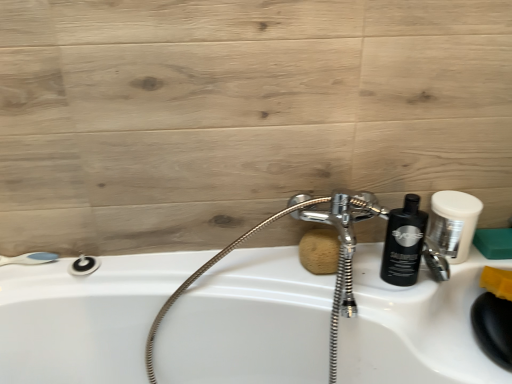
Describe the element at coordinates (319, 251) in the screenshot. The image size is (512, 384). I see `brown sponge at center, arranged as the second soap when viewed from the right` at that location.

Describe the element at coordinates (249, 323) in the screenshot. The image size is (512, 384). I see `white glossy sink at center` at that location.

Image resolution: width=512 pixels, height=384 pixels. I want to click on white glossy sink at center, so click(249, 323).

The width and height of the screenshot is (512, 384). What do you see at coordinates (494, 243) in the screenshot?
I see `green sponge at right, which ranks as the second soap in left-to-right order` at bounding box center [494, 243].

Where is `brown sponge at center, which appears as the 1th soap when viewed from the left`? The width and height of the screenshot is (512, 384). brown sponge at center, which appears as the 1th soap when viewed from the left is located at coordinates (319, 251).

Is point (403, 244) positioned in front of point (386, 349)?

No, (403, 244) is behind (386, 349).

From a real-world perspective, who is located higher, white matte shaving cream at upper right or white glossy sink at center?

white matte shaving cream at upper right.

Can you tell me how much white matte shaving cream at upper right and white glossy sink at center differ in facing direction?

0.0606 degrees.

From the image's perspective, which one is positioned lower, white matte shaving cream at upper right or white glossy sink at center?

white glossy sink at center.

Can you tell me how much brown sponge at center, which appears as the 1th soap when viewed from the left, and black glossy bottle at right differ in facing direction?

0.000436 degrees separate the facing orientations of brown sponge at center, which appears as the 1th soap when viewed from the left, and black glossy bottle at right.

Can you confirm if brown sponge at center, arranged as the second soap when viewed from the right, is bigger than black glossy bottle at right?

Incorrect, brown sponge at center, arranged as the second soap when viewed from the right, is not larger than black glossy bottle at right.

Is point (305, 244) less distant than point (459, 206)?

No, it is not.

Considering the relative sizes of brown sponge at center, arranged as the second soap when viewed from the right, and black glossy bottle at right in the image provided, is brown sponge at center, arranged as the second soap when viewed from the right, wider than black glossy bottle at right?

In fact, brown sponge at center, arranged as the second soap when viewed from the right, might be narrower than black glossy bottle at right.

From the image's perspective, does white plastic shower at left, the 2th shower viewed from the right, appear higher than green sponge at right, which ranks as the second soap in left-to-right order?

No, from the image's perspective, white plastic shower at left, the 2th shower viewed from the right, is not over green sponge at right, which ranks as the second soap in left-to-right order.

Considering the relative sizes of white plastic shower at left, the 2th shower viewed from the right, and green sponge at right, marked as the 1th soap in a right-to-left arrangement, in the image provided, is white plastic shower at left, the 2th shower viewed from the right, smaller than green sponge at right, marked as the 1th soap in a right-to-left arrangement,?

Actually, white plastic shower at left, the 2th shower viewed from the right, might be larger than green sponge at right, marked as the 1th soap in a right-to-left arrangement.

Looking at this image, which is nearer, (39, 263) or (501, 234)?

The point (39, 263) is closer to the camera.

In the scene shown: Can you confirm if white plastic shower at left, placed as the 1th shower when sorted from left to right, is positioned to the left of green sponge at right, which ranks as the second soap in left-to-right order?

Correct, you'll find white plastic shower at left, placed as the 1th shower when sorted from left to right, to the left of green sponge at right, which ranks as the second soap in left-to-right order.

From a real-world perspective, which object stands above the other?

From a 3D spatial view, white matte shaving cream at upper right is above.

Which object is wider, white matte shaving cream at upper right or matte black shower at lower left, the second shower when ordered from left to right?

With larger width is white matte shaving cream at upper right.

Consider the image. Between white matte shaving cream at upper right and matte black shower at lower left, the second shower when ordered from left to right, which one has less height?

matte black shower at lower left, the second shower when ordered from left to right.

From a real-world perspective, is matte black shower at lower left, the second shower when ordered from left to right, positioned over white glossy sink at center based on gravity?

Yes.

From a real-world perspective, count 1st showers upward from the white glossy sink at center and point to it. Please provide its 2D coordinates.

[(84, 265)]

Are matte black shower at lower left, the second shower when ordered from left to right, and white glossy sink at center making contact?

No, matte black shower at lower left, the second shower when ordered from left to right, is not touching white glossy sink at center.

Consider the image. Can we say matte black shower at lower left, the second shower when ordered from left to right, lies outside white glossy sink at center?

matte black shower at lower left, the second shower when ordered from left to right, is positioned outside white glossy sink at center.

From the image's perspective, which soap is the 2nd one below the white matte shaving cream at upper right? Please provide its 2D coordinates.

[(319, 251)]

Does white matte shaving cream at upper right come in front of brown sponge at center, arranged as the second soap when viewed from the right?

Yes, white matte shaving cream at upper right is in front of brown sponge at center, arranged as the second soap when viewed from the right.

Is white matte shaving cream at upper right oriented away from brown sponge at center, which appears as the 1th soap when viewed from the left?

That's not correct — white matte shaving cream at upper right is not looking away from brown sponge at center, which appears as the 1th soap when viewed from the left.

Considering the positions of objects black glossy bottle at right and white glossy sink at center in the image provided, who is behind, black glossy bottle at right or white glossy sink at center?

black glossy bottle at right is more distant.

This screenshot has height=384, width=512. Find the location of `cleaning product located above the white glossy sink at center (from the image's perspective)`. cleaning product located above the white glossy sink at center (from the image's perspective) is located at coordinates (453, 223).

From a real-world perspective, is black glossy bottle at right physically located above or below white glossy sink at center?

black glossy bottle at right is above white glossy sink at center.

Identify the location of shaving cream that is behind the white glossy sink at center. (404, 243).

Where is `cleaning product located above the brown sponge at center, which appears as the 1th soap when viewed from the left (from a real-world perspective)`? cleaning product located above the brown sponge at center, which appears as the 1th soap when viewed from the left (from a real-world perspective) is located at coordinates (453, 223).

Which object lies further to the anchor point white matte shaving cream at upper right, green sponge at right, which ranks as the second soap in left-to-right order, or white glossy sink at center?

Based on the image, white glossy sink at center appears to be further to white matte shaving cream at upper right.

Considering their positions, is matte black shower at lower left, the second shower when ordered from left to right, positioned closer to white glossy sink at center than black glossy bottle at right?

The object closer to white glossy sink at center is matte black shower at lower left, the second shower when ordered from left to right.

Looking at the image, which one is located closer to brown sponge at center, which appears as the 1th soap when viewed from the left, green sponge at right, marked as the 1th soap in a right-to-left arrangement, or matte black shower at lower left, arranged as the first shower when viewed from the right?

Among the two, green sponge at right, marked as the 1th soap in a right-to-left arrangement, is located nearer to brown sponge at center, which appears as the 1th soap when viewed from the left.

Considering their positions, is black glossy bottle at right positioned closer to white matte shaving cream at upper right than brown sponge at center, arranged as the second soap when viewed from the right?

Based on the image, black glossy bottle at right appears to be nearer to white matte shaving cream at upper right.

Estimate the real-world distances between objects in this image. Which object is closer to matte black shower at lower left, arranged as the first shower when viewed from the right, black glossy bottle at right or white plastic shower at left, the 2th shower viewed from the right?

The object closer to matte black shower at lower left, arranged as the first shower when viewed from the right, is white plastic shower at left, the 2th shower viewed from the right.

Based on their spatial positions, is white glossy sink at center or green sponge at right, marked as the 1th soap in a right-to-left arrangement, closer to matte black shower at lower left, the second shower when ordered from left to right?

Based on the image, white glossy sink at center appears to be nearer to matte black shower at lower left, the second shower when ordered from left to right.

When comparing their distances from white glossy sink at center, does brown sponge at center, which appears as the 1th soap when viewed from the left, or matte black shower at lower left, arranged as the first shower when viewed from the right, seem further?

matte black shower at lower left, arranged as the first shower when viewed from the right, lies further to white glossy sink at center than the other object.

From the picture: When comparing their distances from white glossy sink at center, does black glossy bottle at right or matte black shower at lower left, arranged as the first shower when viewed from the right, seem closer?

matte black shower at lower left, arranged as the first shower when viewed from the right.

Locate an element on the screen. The width and height of the screenshot is (512, 384). sink located between white plastic shower at left, placed as the 1th shower when sorted from left to right, and black glossy bottle at right in the left-right direction is located at coordinates (249, 323).

You are a GUI agent. You are given a task and a screenshot of the screen. Output one action in this format:
    pyautogui.click(x=<x>, y=<y>)
    Task: Click on the sink located between white plastic shower at left, the 2th shower viewed from the right, and brown sponge at center, arranged as the second soap when viewed from the right, in the left-right direction
    The height and width of the screenshot is (384, 512).
    Given the screenshot: What is the action you would take?
    pyautogui.click(x=249, y=323)

At what (x,y) coordinates should I click in order to perform the action: click on shaving cream between white glossy sink at center and green sponge at right, marked as the 1th soap in a right-to-left arrangement, from left to right. Please return your answer as a coordinate pair (x, y). Image resolution: width=512 pixels, height=384 pixels. Looking at the image, I should click on point(404,243).

I want to click on shaving cream between white plastic shower at left, placed as the 1th shower when sorted from left to right, and green sponge at right, which ranks as the second soap in left-to-right order, from left to right, so click(x=404, y=243).